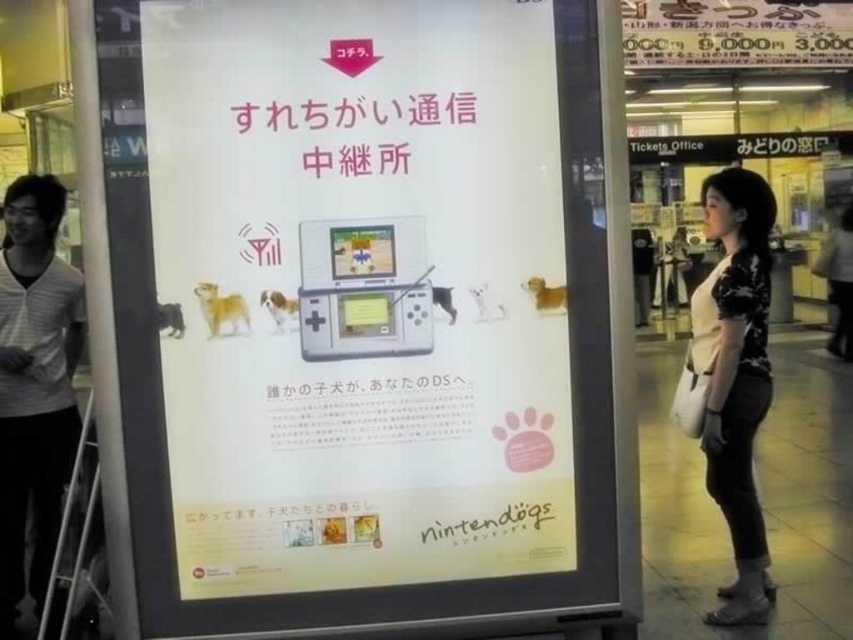
Describe the element at coordinates (33, 385) in the screenshot. Image resolution: width=853 pixels, height=640 pixels. I see `gray striped shirt at left` at that location.

Which is behind, point (77, 358) or point (759, 312)?

Point (77, 358)

You are a GUI agent. You are given a task and a screenshot of the screen. Output one action in this format:
    pyautogui.click(x=<x>, y=<y>)
    Task: Click on the gray striped shirt at left
    This screenshot has height=640, width=853.
    Given the screenshot: What is the action you would take?
    pyautogui.click(x=33, y=385)

Is white paper poster at center smaller than black floral shirt at center?

Correct, white paper poster at center occupies less space than black floral shirt at center.

Who is more forward, (160,220) or (712,284)?

Point (160,220) is more forward.

This screenshot has width=853, height=640. What are the coordinates of `white paper poster at center` in the screenshot? It's located at (358, 291).

Which is in front, point (310, 131) or point (1, 593)?

Point (310, 131) is more forward.

Which is behind, point (376, 176) or point (18, 548)?

The point (18, 548) is more distant.

Locate an element on the screen. white paper poster at center is located at coordinates (358, 291).